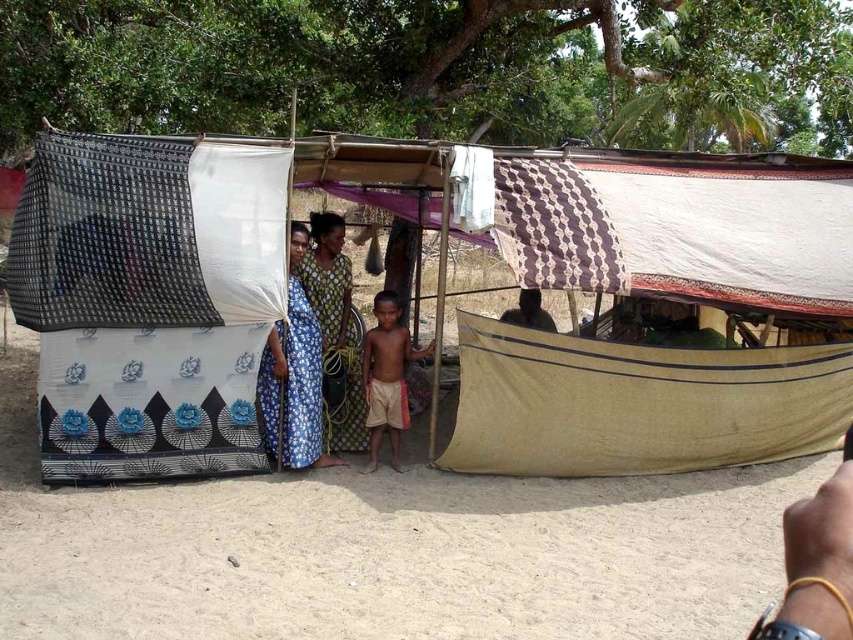
Between blue printed fabric dress at center and tan cotton shorts at center, which one appears on the right side from the viewer's perspective?

tan cotton shorts at center

Is blue printed fabric dress at center positioned in front of tan cotton shorts at center?

Yes, blue printed fabric dress at center is in front of tan cotton shorts at center.

Image resolution: width=853 pixels, height=640 pixels. Identify the location of blue printed fabric dress at center. (294, 376).

Can you confirm if beige canvas tent at right is positioned to the left of blue printed fabric dress at center?

In fact, beige canvas tent at right is to the right of blue printed fabric dress at center.

Is point (769, 429) positioned after point (311, 428)?

Yes, point (769, 429) is farther from viewer.

Find the location of a particular element. This screenshot has height=640, width=853. beige canvas tent at right is located at coordinates (637, 404).

Measure the distance between beige canvas tent at right and tan cotton shorts at center.

They are 2.01 meters apart.

Which of these two, beige canvas tent at right or tan cotton shorts at center, stands taller?

tan cotton shorts at center

Does point (692, 433) come closer to viewer compared to point (415, 355)?

That is True.

The width and height of the screenshot is (853, 640). What are the coordinates of `beige canvas tent at right` in the screenshot? It's located at (637, 404).